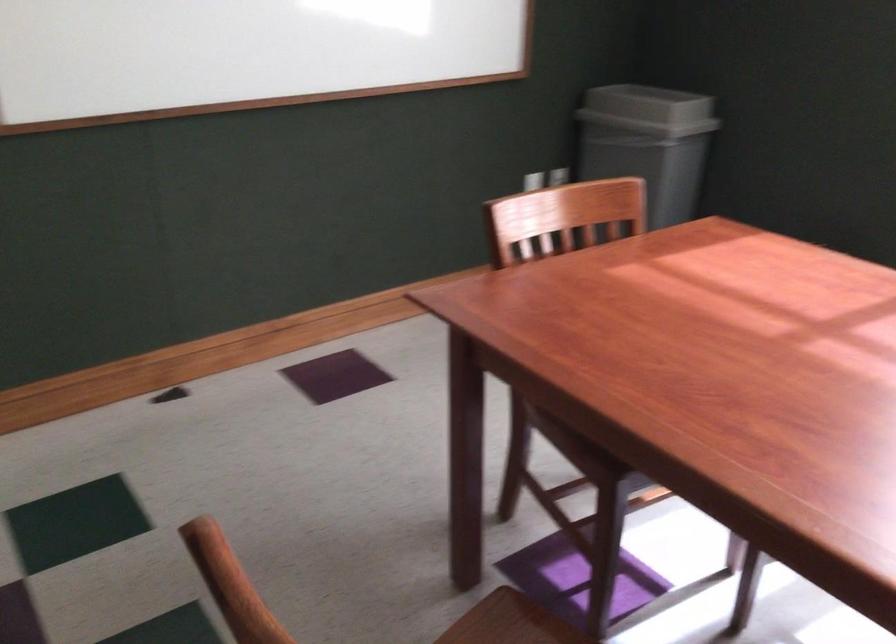
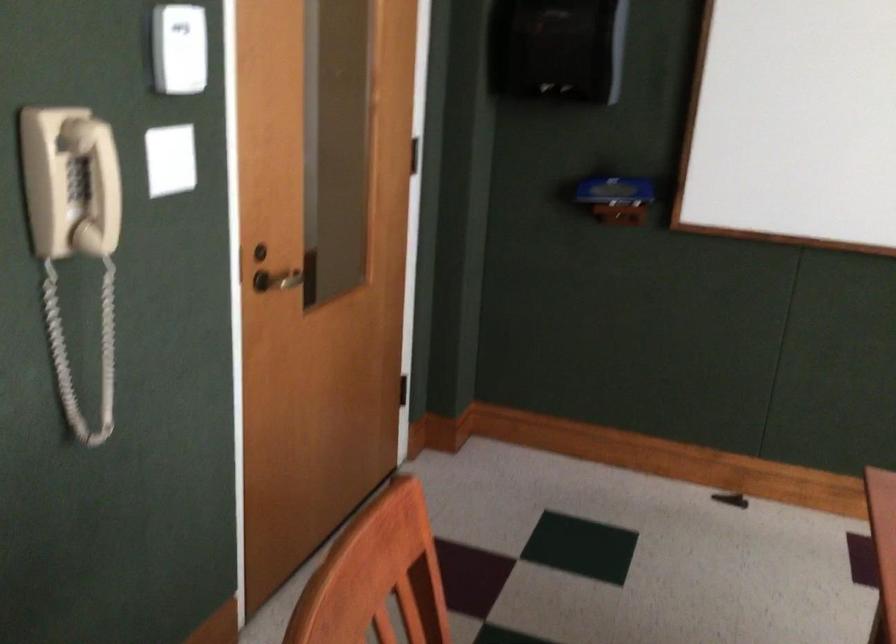
Question: The camera is either moving clockwise (left) or counter-clockwise (right) around the object. The first image is from the beginning of the video and the second image is from the end. Is the camera moving left or right when shooting the video?

Choices:
 (A) Left
 (B) Right

Answer: (B)